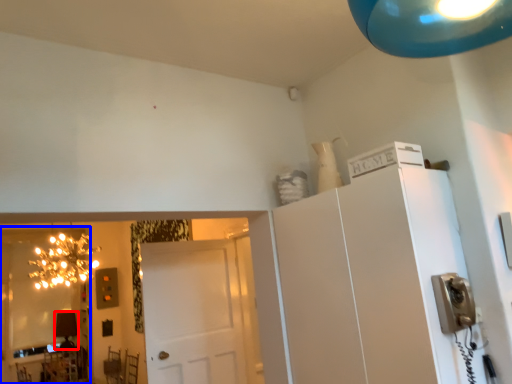
Question: Which object appears closest to the camera in this image, lamp (highlighted by a red box) or mirror (highlighted by a blue box)?

Choices:
 (A) lamp
 (B) mirror

Answer: (B)